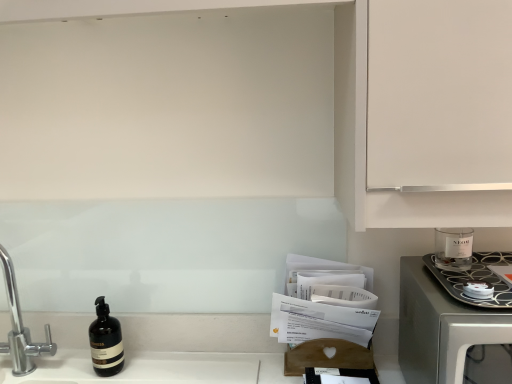
Question: Considering the positions of satin silver microwave at right and clear glass candle at right in the image, is satin silver microwave at right bigger or smaller than clear glass candle at right?

Choices:
 (A) small
 (B) big

Answer: (B)

Question: In the image, is satin silver microwave at right on the left side or the right side of clear glass candle at right?

Choices:
 (A) right
 (B) left

Answer: (A)

Question: Which is farther from the satin silver microwave at right?

Choices:
 (A) chrome metallic faucet at left
 (B) matte black bottle at lower left
 (C) clear glass candle at right

Answer: (A)

Question: Which object is positioned closest to the matte black bottle at lower left?

Choices:
 (A) satin silver microwave at right
 (B) chrome metallic faucet at left
 (C) clear glass candle at right

Answer: (B)